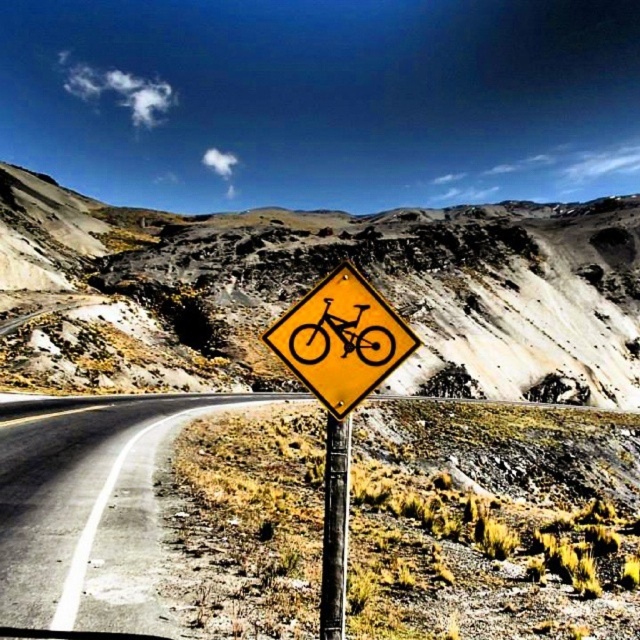
You are a cyclist approaching the yellow diamond sign at center and the asphalt road at center. Which object appears larger to you as you look ahead?

The yellow diamond sign at center appears larger than the asphalt road at center because it is bigger in size according to the description.

You are a cyclist planning to ride along the desert road. You see the yellow diamond sign at center and the metallic pole at center. How far apart are these two objects from each other?

The yellow diamond sign at center and the metallic pole at center are 250.17 meters apart.